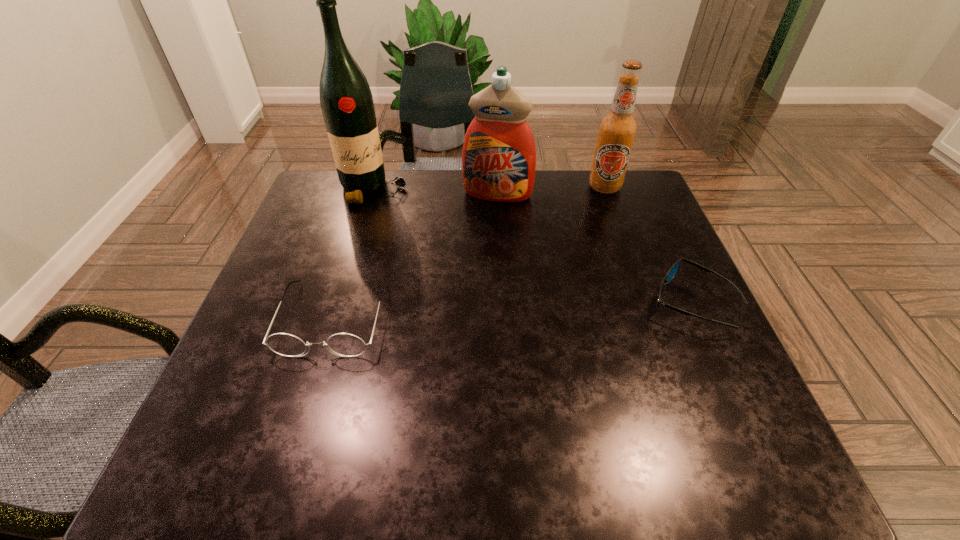
Image resolution: width=960 pixels, height=540 pixels. In order to click on unoccupied area between the fourth tallest object and the shortest object in this screenshot , I will do `click(513, 310)`.

The width and height of the screenshot is (960, 540). What are the coordinates of `free space between the sunglasses and the detergent` in the screenshot? It's located at (595, 248).

This screenshot has width=960, height=540. In order to click on empty space that is in between the beer bottle and the third object from left to right in this screenshot , I will do `click(551, 191)`.

At what (x,y) coordinates should I click in order to perform the action: click on unoccupied position between the shortest object and the beer bottle. Please return your answer as a coordinate pair (x, y). This screenshot has height=540, width=960. Looking at the image, I should click on (648, 245).

This screenshot has width=960, height=540. I want to click on vacant space that's between the third object from right to left and the tallest object, so click(x=436, y=191).

Identify the location of empty location between the sunglasses and the second shortest object. (513, 310).

Image resolution: width=960 pixels, height=540 pixels. In order to click on free spot between the wine bottle and the shortest object in this screenshot , I will do `click(533, 245)`.

Where is `free space between the sunglasses and the beer bottle`? Image resolution: width=960 pixels, height=540 pixels. free space between the sunglasses and the beer bottle is located at coordinates (648, 245).

The height and width of the screenshot is (540, 960). Identify the location of vacant space in between the tallest object and the shortest object. (533, 245).

Identify the location of empty location between the third object from right to left and the second shortest object. Image resolution: width=960 pixels, height=540 pixels. (416, 256).